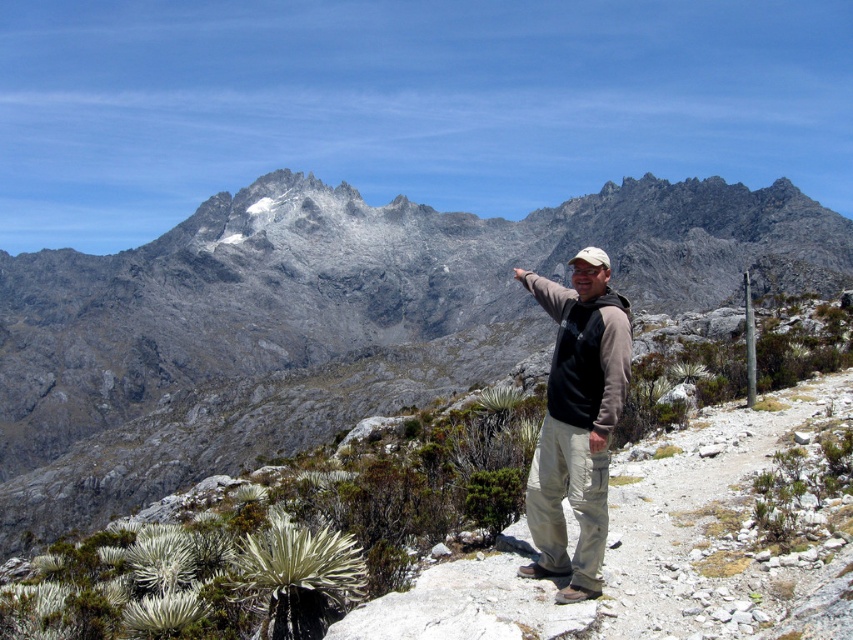
You are a hiker planning to climb the gray rocky mountain at center. You see the smooth dirt path at center leading towards the mountain. Which direction should you walk to get closer to the mountain?

The gray rocky mountain at center is taller than the smooth dirt path at center, so you should walk along the smooth dirt path at center towards the mountain to get closer.

Based on the scene description, what is located at the coordinates point (337, 323)?

The gray rocky mountain at center is located at point (337, 323).